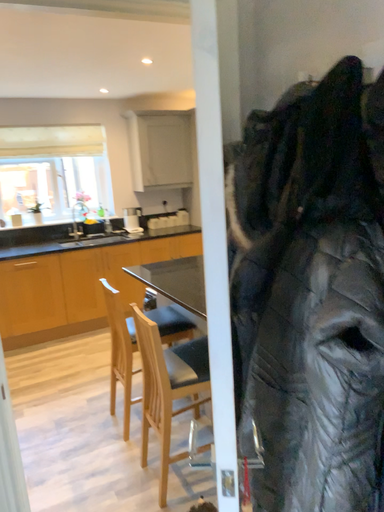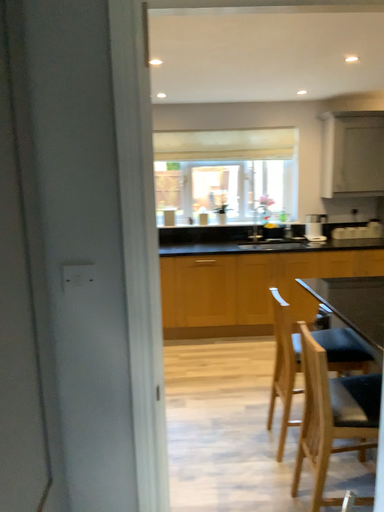
Question: How did the camera likely rotate when shooting the video?

Choices:
 (A) rotated left
 (B) rotated right

Answer: (A)